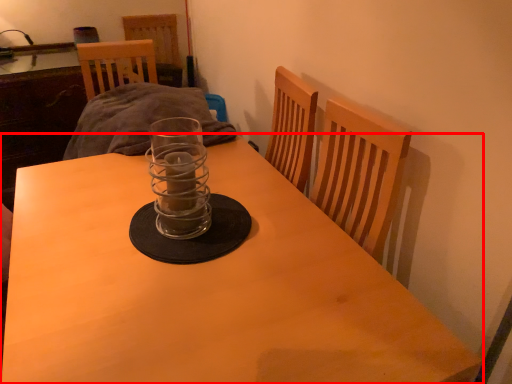
Question: From the image's perspective, what is the correct spatial relationship of table (annotated by the red box) in relation to candle holder?

Choices:
 (A) below
 (B) above

Answer: (A)